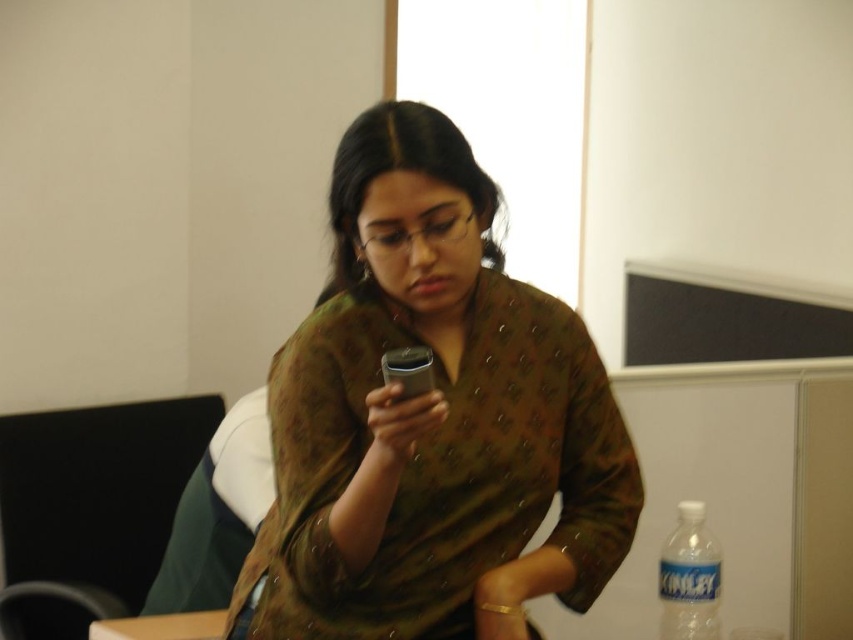
You are organizing a small event and need to cover the wooden table at lower left with a cloth. You have the brown textured shawl at center available. Based on the image, will the shawl be large enough to cover the table?

The brown textured shawl at center is larger in size than wooden table at lower left, so yes, the shawl will be large enough to cover the table.

You are organizing a study session and need to place a laptop on the wooden table at lower left. However, there is a brown textured shawl at center in the way. Can you move the shawl to the left to make space for the laptop?

The brown textured shawl at center is currently to the right of the wooden table at lower left. To make space, moving it to the left would place it further away from the table, which might not be ideal. Alternatively, moving it to the right would position it even farther from the table. However, since the shawl is already to the right of the table, moving it to the left towards the table could create space. Wait, the description says the shawl is to the right of the table. So if you move it to the left, it

You are organizing a study session and need to ensure there is enough space on the desk for both the brown textured shawl at center and the clear plastic bottle at lower right. Based on their positions, can you place the bottle under the shawl without moving the shawl?

The brown textured shawl at center is above the clear plastic bottle at lower right, so yes, you can place the bottle under the shawl without moving it since it is already positioned beneath the shawl.